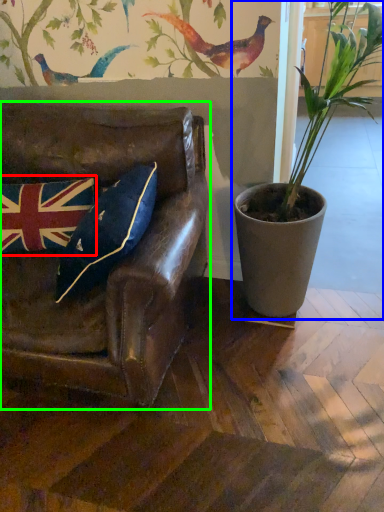
Question: Which object is positioned farthest from flag (highlighted by a red box)? Select from houseplant (highlighted by a blue box) and chair (highlighted by a green box).

Choices:
 (A) houseplant
 (B) chair

Answer: (A)